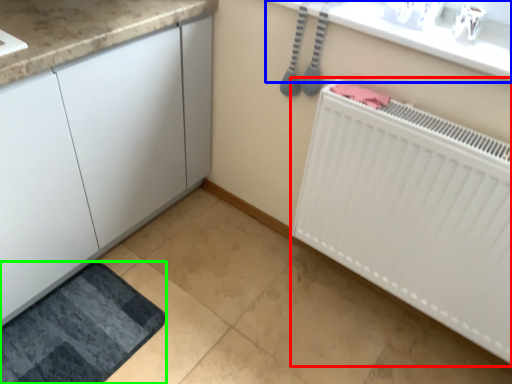
Question: Estimate the real-world distances between objects in this image. Which object is farther from radiator (highlighted by a red box), counter top (highlighted by a blue box) or bath mat (highlighted by a green box)?

Choices:
 (A) counter top
 (B) bath mat

Answer: (B)